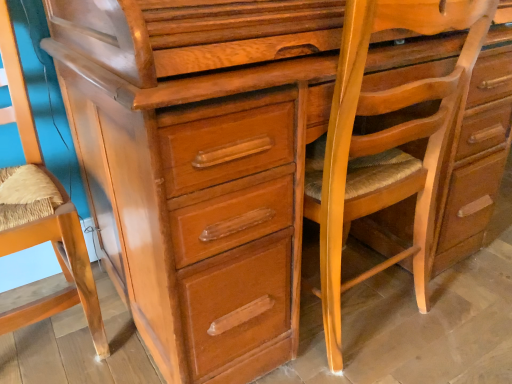
This screenshot has height=384, width=512. Describe the element at coordinates (45, 216) in the screenshot. I see `wooden textured swivel chair at left` at that location.

Measure the distance between point (60, 299) and camera.

A distance of 1.04 meters exists between point (60, 299) and camera.

The image size is (512, 384). I want to click on wooden textured swivel chair at left, so click(x=45, y=216).

Find the location of a particular element. This screenshot has height=384, width=512. light brown wood rocking chair at center is located at coordinates (384, 142).

What do you see at coordinates (384, 142) in the screenshot? I see `light brown wood rocking chair at center` at bounding box center [384, 142].

Identify the location of wooden textured swivel chair at left. The height and width of the screenshot is (384, 512). (45, 216).

Is light brown wood rocking chair at center to the right of wooden textured swivel chair at left from the viewer's perspective?

Indeed, light brown wood rocking chair at center is positioned on the right side of wooden textured swivel chair at left.

Who is more distant, light brown wood rocking chair at center or wooden textured swivel chair at left?

light brown wood rocking chair at center is behind.

Does point (457, 24) come behind point (7, 80)?

No, (457, 24) is in front of (7, 80).

Based on the photo, from the image's perspective, is light brown wood rocking chair at center positioned above or below wooden textured swivel chair at left?

Clearly, from the image's perspective, light brown wood rocking chair at center is above wooden textured swivel chair at left.

From a real-world perspective, who is located higher, light brown wood rocking chair at center or wooden textured swivel chair at left?

light brown wood rocking chair at center, from a real-world perspective.

Looking at their sizes, would you say light brown wood rocking chair at center is wider or thinner than wooden textured swivel chair at left?

Clearly, light brown wood rocking chair at center has less width compared to wooden textured swivel chair at left.

Considering the sizes of objects light brown wood rocking chair at center and wooden textured swivel chair at left in the image provided, who is shorter, light brown wood rocking chair at center or wooden textured swivel chair at left?

light brown wood rocking chair at center is shorter.

Is light brown wood rocking chair at center bigger or smaller than wooden textured swivel chair at left?

In the image, light brown wood rocking chair at center appears to be larger than wooden textured swivel chair at left.

Is light brown wood rocking chair at center not within wooden textured swivel chair at left?

Yes, light brown wood rocking chair at center is not within wooden textured swivel chair at left.

Are light brown wood rocking chair at center and wooden textured swivel chair at left located far from each other?

They are positioned close to each other.

Is light brown wood rocking chair at center aimed at wooden textured swivel chair at left?

No, light brown wood rocking chair at center is not aimed at wooden textured swivel chair at left.

Identify the location of rocking chair that is on the right side of wooden textured swivel chair at left. (384, 142).

Between wooden textured swivel chair at left and light brown wood rocking chair at center, which one appears on the left side from the viewer's perspective?

wooden textured swivel chair at left is more to the left.

Which is in front, wooden textured swivel chair at left or light brown wood rocking chair at center?

wooden textured swivel chair at left is more forward.

Is point (76, 247) closer or farther from the camera than point (419, 217)?

Point (76, 247) is positioned closer to the camera compared to point (419, 217).

From the image's perspective, is wooden textured swivel chair at left above or below light brown wood rocking chair at center?

wooden textured swivel chair at left is situated lower than light brown wood rocking chair at center in the image.

From a real-world perspective, is wooden textured swivel chair at left under light brown wood rocking chair at center?

Indeed, from a real-world perspective, wooden textured swivel chair at left is positioned beneath light brown wood rocking chair at center.

Which object is wider, wooden textured swivel chair at left or light brown wood rocking chair at center?

With larger width is wooden textured swivel chair at left.

Considering the sizes of objects wooden textured swivel chair at left and light brown wood rocking chair at center in the image provided, who is shorter, wooden textured swivel chair at left or light brown wood rocking chair at center?

Standing shorter between the two is light brown wood rocking chair at center.

Which of these two, wooden textured swivel chair at left or light brown wood rocking chair at center, is bigger?

light brown wood rocking chair at center is bigger.

Do you think wooden textured swivel chair at left is within light brown wood rocking chair at center, or outside of it?

wooden textured swivel chair at left is not enclosed by light brown wood rocking chair at center.

Is wooden textured swivel chair at left placed right next to light brown wood rocking chair at center?

There is a gap between wooden textured swivel chair at left and light brown wood rocking chair at center.

Could you tell me if wooden textured swivel chair at left is turned towards light brown wood rocking chair at center?

No, wooden textured swivel chair at left is not aimed at light brown wood rocking chair at center.

Can you tell me how much wooden textured swivel chair at left and light brown wood rocking chair at center differ in facing direction?

The angular difference between wooden textured swivel chair at left and light brown wood rocking chair at center is 177 degrees.

Find the location of a particular element. The image size is (512, 384). rocking chair behind the wooden textured swivel chair at left is located at coordinates (384, 142).

You are a GUI agent. You are given a task and a screenshot of the screen. Output one action in this format:
    pyautogui.click(x=<x>, y=<y>)
    Task: Click on the swivel chair on the left of light brown wood rocking chair at center
    This screenshot has width=512, height=384.
    Given the screenshot: What is the action you would take?
    pyautogui.click(x=45, y=216)

In order to click on swivel chair that appears below the light brown wood rocking chair at center (from a real-world perspective) in this screenshot , I will do `click(45, 216)`.